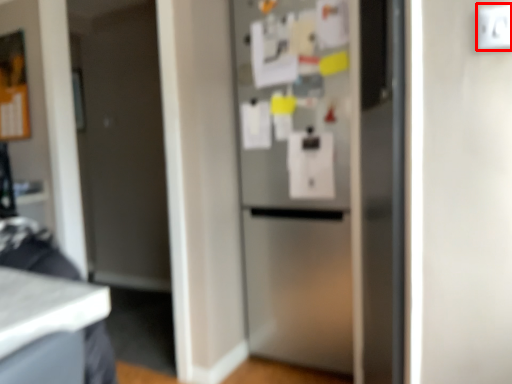
Question: From the image's perspective, what is the correct spatial positioning of electric outlet (annotated by the red box) in reference to refrigerator?

Choices:
 (A) above
 (B) below

Answer: (A)